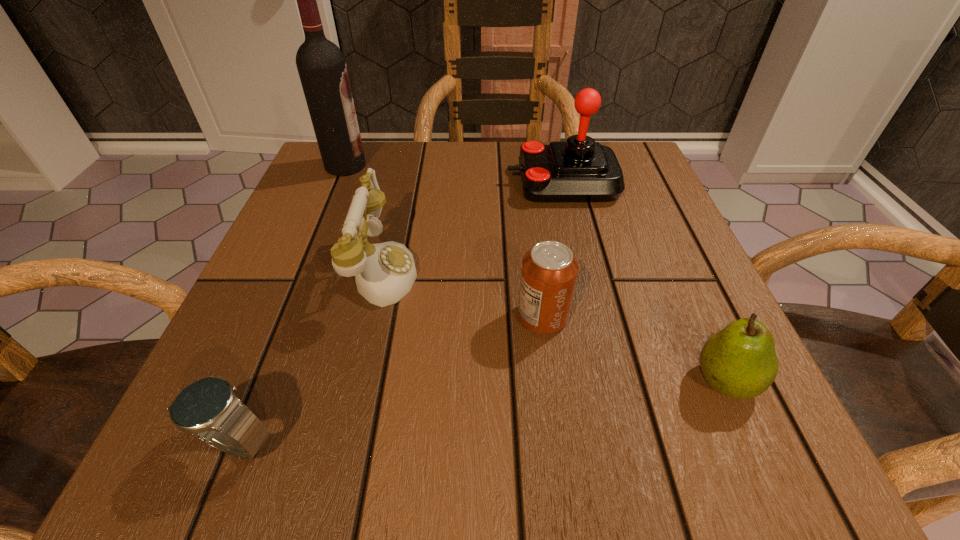
Locate an element on the screen. The image size is (960, 540). vacant space at the left edge is located at coordinates (285, 252).

You are a GUI agent. You are given a task and a screenshot of the screen. Output one action in this format:
    pyautogui.click(x=<x>, y=<y>)
    Task: Click on the vacant space at the right edge of the desktop
    This screenshot has height=540, width=960.
    Given the screenshot: What is the action you would take?
    pyautogui.click(x=694, y=359)

In the image, there is a desktop. Where is `free space at the far left corner`? The width and height of the screenshot is (960, 540). free space at the far left corner is located at coordinates (373, 157).

The image size is (960, 540). What are the coordinates of `vacant space at the near left corner` in the screenshot? It's located at (x=213, y=461).

Identify the location of free space at the far right corner. The height and width of the screenshot is (540, 960). (649, 181).

Locate an element on the screen. The height and width of the screenshot is (540, 960). vacant space in between the nearest object and the second tallest object is located at coordinates (399, 313).

You are a GUI agent. You are given a task and a screenshot of the screen. Output one action in this format:
    pyautogui.click(x=<x>, y=<y>)
    Task: Click on the free area in between the can and the wine bottle
    The height and width of the screenshot is (540, 960).
    Given the screenshot: What is the action you would take?
    pyautogui.click(x=444, y=241)

At what (x,y) coordinates should I click in order to perform the action: click on vacant space that is in between the pear and the can. Please return your answer as a coordinate pair (x, y). Image resolution: width=960 pixels, height=540 pixels. Looking at the image, I should click on (635, 349).

This screenshot has height=540, width=960. Identify the location of unoccupied position between the can and the shortest object. (390, 380).

Locate an element on the screen. The height and width of the screenshot is (540, 960). free space between the telephone and the shortest object is located at coordinates (308, 356).